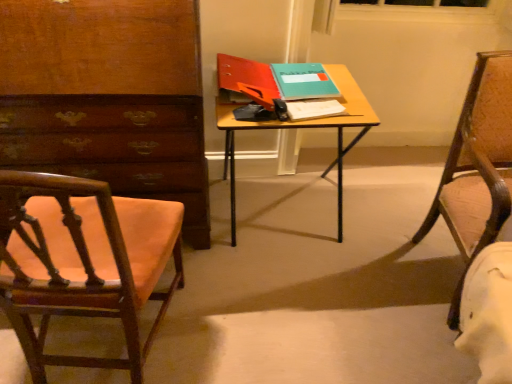
Where is `vacant space underneath wooden chair at left, marked as the 2th chair in a right-to-left arrangement (from a real-world perspective)`? vacant space underneath wooden chair at left, marked as the 2th chair in a right-to-left arrangement (from a real-world perspective) is located at coordinates (108, 345).